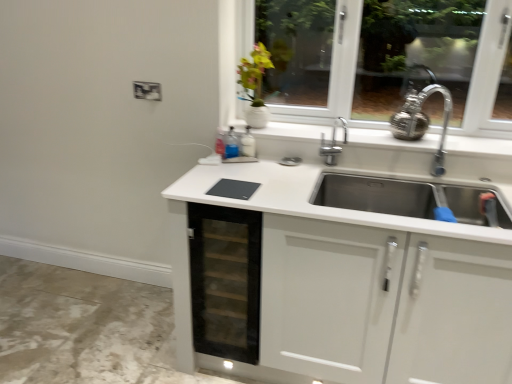
The width and height of the screenshot is (512, 384). What do you see at coordinates (254, 74) in the screenshot?
I see `green matte vase at upper center` at bounding box center [254, 74].

The height and width of the screenshot is (384, 512). What are the coordinates of `green matte vase at upper center` in the screenshot? It's located at (254, 74).

Describe the element at coordinates (225, 280) in the screenshot. I see `transparent glass drawer at center` at that location.

Find the location of a particular element. The width and height of the screenshot is (512, 384). transparent glass drawer at center is located at coordinates (225, 280).

In order to click on green matte vase at upper center in this screenshot , I will do `click(254, 74)`.

Would you say transparent glass drawer at center is to the left or to the right of green matte vase at upper center in the picture?

In the image, transparent glass drawer at center appears on the left side of green matte vase at upper center.

Is transparent glass drawer at center in front of or behind green matte vase at upper center in the image?

transparent glass drawer at center is positioned closer to the viewer than green matte vase at upper center.

Which point is more forward, (202, 330) or (261, 79)?

The point (202, 330) is more forward.

From the image's perspective, does transparent glass drawer at center appear higher than green matte vase at upper center?

Incorrect, from the image's perspective, transparent glass drawer at center is lower than green matte vase at upper center.

From a real-world perspective, is transparent glass drawer at center beneath green matte vase at upper center?

Yes, from a real-world perspective, transparent glass drawer at center is under green matte vase at upper center.

Is transparent glass drawer at center wider or thinner than green matte vase at upper center?

transparent glass drawer at center is wider than green matte vase at upper center.

Can you confirm if transparent glass drawer at center is shorter than green matte vase at upper center?

Incorrect, the height of transparent glass drawer at center does not fall short of that of green matte vase at upper center.

Is transparent glass drawer at center bigger than green matte vase at upper center?

Correct, transparent glass drawer at center is larger in size than green matte vase at upper center.

Is green matte vase at upper center inside transparent glass drawer at center?

Actually, green matte vase at upper center is outside transparent glass drawer at center.

In the scene shown: Would you say transparent glass drawer at center is a long distance from green matte vase at upper center?

transparent glass drawer at center is near green matte vase at upper center, not far away.

Is transparent glass drawer at center facing away from green matte vase at upper center?

No, transparent glass drawer at center's orientation is not away from green matte vase at upper center.

How different are the orientations of transparent glass drawer at center and green matte vase at upper center in degrees?

They differ by 0.00145 degrees in their facing directions.

In the scene shown: How far apart are transparent glass drawer at center and green matte vase at upper center?

A: transparent glass drawer at center and green matte vase at upper center are 88.27 centimeters apart.

Locate an element on the screen. This screenshot has height=384, width=512. flower lying above the transparent glass drawer at center (from the image's perspective) is located at coordinates pyautogui.click(x=254, y=74).

In the image, is green matte vase at upper center on the left side or the right side of transparent glass drawer at center?

Clearly, green matte vase at upper center is on the right of transparent glass drawer at center in the image.

Considering the positions of objects green matte vase at upper center and transparent glass drawer at center in the image provided, who is behind, green matte vase at upper center or transparent glass drawer at center?

green matte vase at upper center is behind.

Does point (245, 70) come in front of point (214, 323)?

No, (245, 70) is further to viewer.

From the image's perspective, is green matte vase at upper center under transparent glass drawer at center?

No.

From a real-world perspective, which object rests below the other?

In real-world perspective, transparent glass drawer at center is lower.

Which of these two, green matte vase at upper center or transparent glass drawer at center, is wider?

transparent glass drawer at center is wider.

Can you confirm if green matte vase at upper center is taller than transparent glass drawer at center?

No.

Can you confirm if green matte vase at upper center is smaller than transparent glass drawer at center?

Yes.

Is green matte vase at upper center inside or outside of transparent glass drawer at center?

green matte vase at upper center lies outside transparent glass drawer at center.

Is green matte vase at upper center next to transparent glass drawer at center?

There is a gap between green matte vase at upper center and transparent glass drawer at center.

Is green matte vase at upper center aimed at transparent glass drawer at center?

No, green matte vase at upper center is not turned towards transparent glass drawer at center.

How far apart are green matte vase at upper center and transparent glass drawer at center?

A distance of 34.75 inches exists between green matte vase at upper center and transparent glass drawer at center.

Locate an element on the screen. This screenshot has height=384, width=512. flower above the transparent glass drawer at center (from a real-world perspective) is located at coordinates (254, 74).

I want to click on flower above the transparent glass drawer at center (from the image's perspective), so coord(254,74).

Image resolution: width=512 pixels, height=384 pixels. What are the coordinates of `flower on the right of transparent glass drawer at center` in the screenshot? It's located at (254, 74).